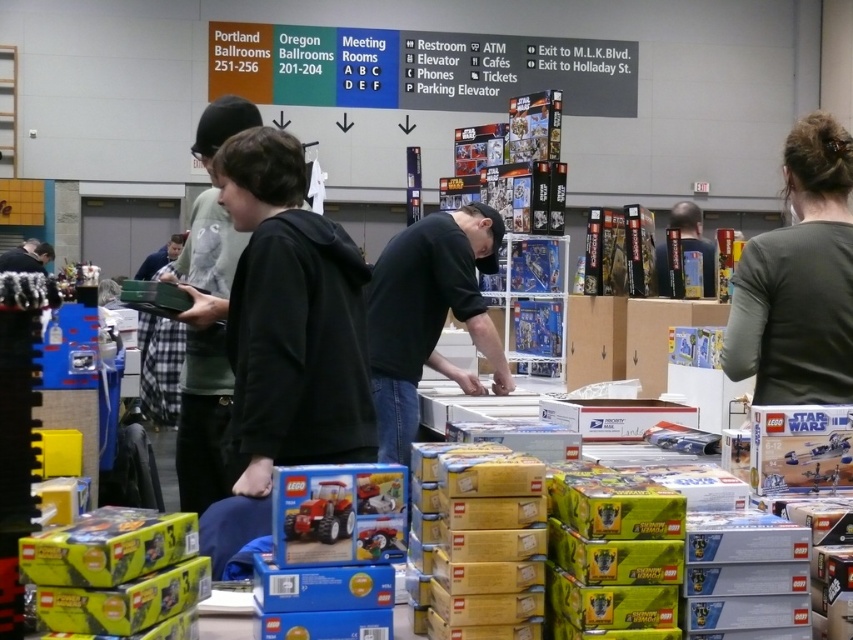
Does dark gray long-sleeve shirt at upper right have a lesser height compared to matte red tractor at center?

No, dark gray long-sleeve shirt at upper right is not shorter than matte red tractor at center.

Which is behind, point (786, 388) or point (332, 484)?

The point (786, 388) is behind.

Which is behind, point (824, 371) or point (347, 528)?

Point (824, 371)

Locate an element on the screen. The height and width of the screenshot is (640, 853). dark gray long-sleeve shirt at upper right is located at coordinates (799, 280).

Is black matte shirt at center shorter than matte black hoodie at left?

Incorrect, black matte shirt at center's height does not fall short of matte black hoodie at left's.

Measure the distance between black matte shirt at center and matte black hoodie at left.

black matte shirt at center and matte black hoodie at left are 8.88 meters apart.

Image resolution: width=853 pixels, height=640 pixels. Describe the element at coordinates (428, 314) in the screenshot. I see `black matte shirt at center` at that location.

Locate an element on the screen. Image resolution: width=853 pixels, height=640 pixels. black matte shirt at center is located at coordinates (428, 314).

Is matte black figure at center to the right of matte black hoodie at left from the viewer's perspective?

Correct, you'll find matte black figure at center to the right of matte black hoodie at left.

Who is shorter, matte black figure at center or matte black hoodie at left?

Standing shorter between the two is matte black figure at center.

Where is `matte black figure at center`? matte black figure at center is located at coordinates (694, 240).

Where is `matte black figure at center`? matte black figure at center is located at coordinates (694, 240).